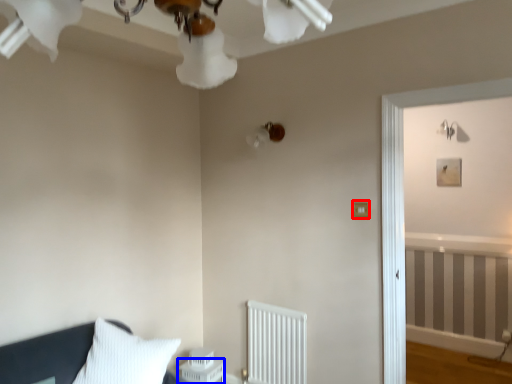
Question: Which object is closer to the camera taking this photo, light switch (highlighted by a red box) or table (highlighted by a blue box)?

Choices:
 (A) light switch
 (B) table

Answer: (A)